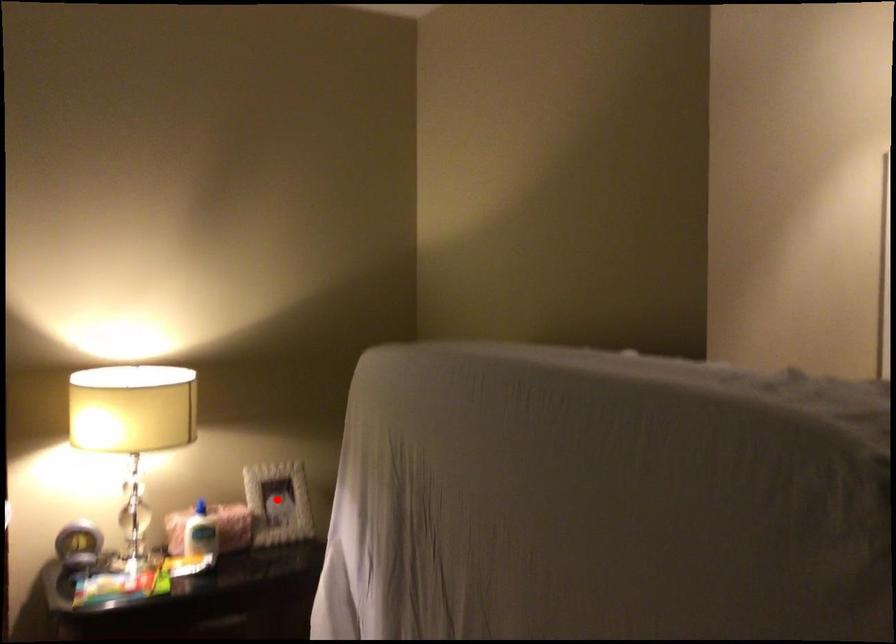
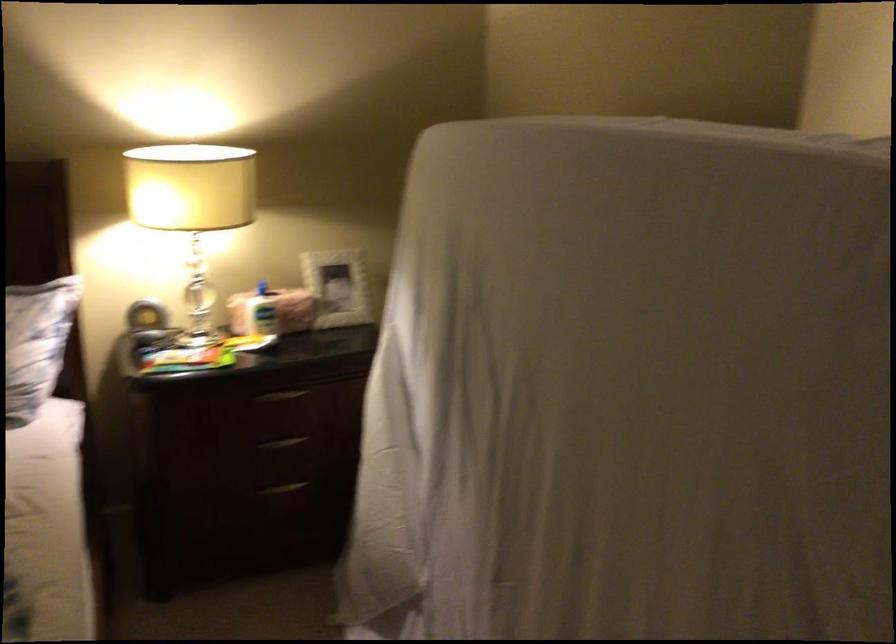
Find the pixel in the second image that matches the highlighted location in the first image.

(337, 287)